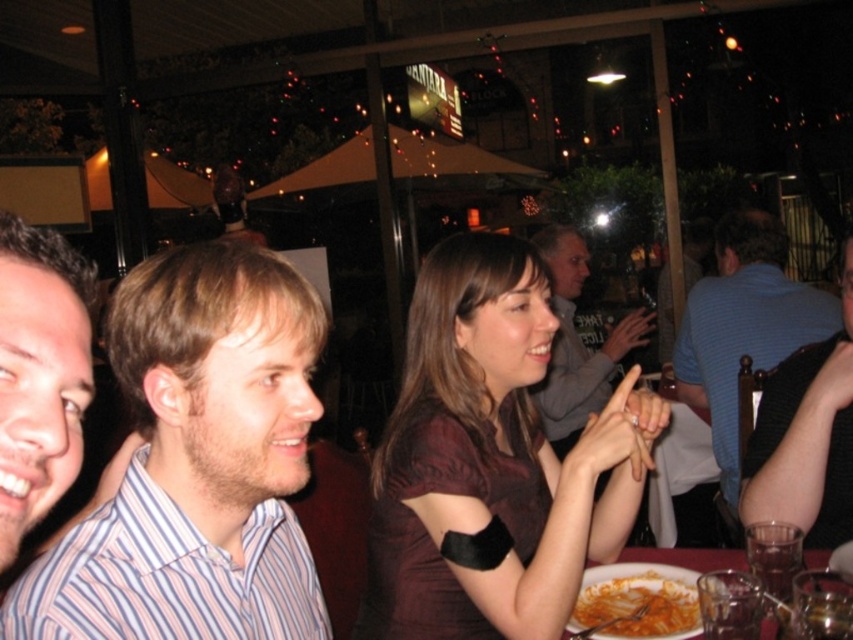
Question: Which is nearer to the white glossy plate at lower center?

Choices:
 (A) striped cotton shirt at left
 (B) striped shirt at left
 (C) gray sweater at center

Answer: (A)

Question: Is gray sweater at center bigger than tomato sauce pasta at lower right?

Choices:
 (A) yes
 (B) no

Answer: (A)

Question: Can you confirm if matte brown dress at center is positioned below blue striped shirt at right?

Choices:
 (A) yes
 (B) no

Answer: (A)

Question: Among these points, which one is nearest to the camera?

Choices:
 (A) (724, 480)
 (B) (538, 500)

Answer: (B)

Question: Observing the image, what is the correct spatial positioning of tomato sauce pasta at lower right in reference to white glossy plate at lower center?

Choices:
 (A) right
 (B) left

Answer: (B)

Question: Which point is farther to the camera?

Choices:
 (A) tomato sauce pasta at lower right
 (B) striped cotton shirt at left

Answer: (A)